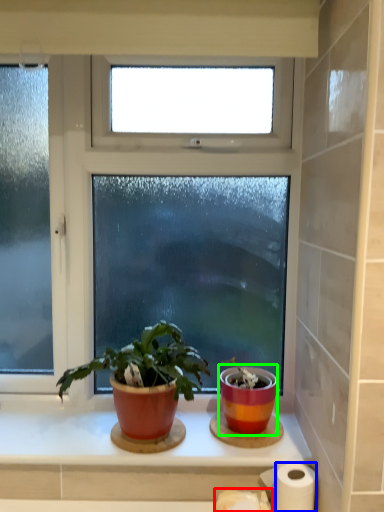
Question: Which object is positioned farthest from toilet paper (highlighted by a red box)? Select from paper towel (highlighted by a blue box) and flowerpot (highlighted by a green box).

Choices:
 (A) paper towel
 (B) flowerpot

Answer: (B)